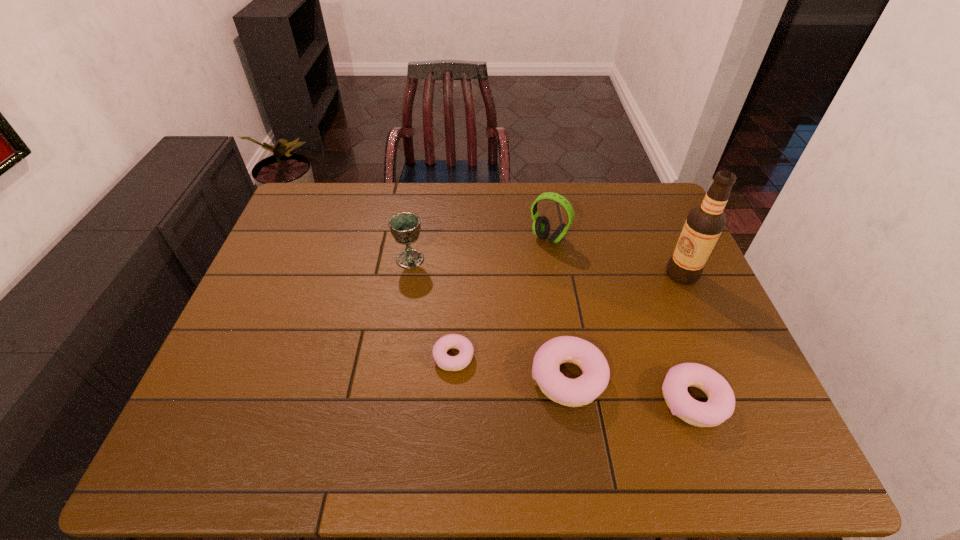
At what (x,y) coordinates should I click in order to perform the action: click on free space located 0.120m on the left of the second shortest doughnut. Please return your answer as a coordinate pair (x, y). The height and width of the screenshot is (540, 960). Looking at the image, I should click on (607, 401).

At what (x,y) coordinates should I click in order to perform the action: click on free spot located on the left of the headset. Please return your answer as a coordinate pair (x, y). Image resolution: width=960 pixels, height=540 pixels. Looking at the image, I should click on (497, 238).

The width and height of the screenshot is (960, 540). I want to click on vacant space situated 0.320m on the right of the chalice, so click(x=532, y=259).

Locate an element on the screen. The width and height of the screenshot is (960, 540). vacant region located on the label of the tallest object is located at coordinates (617, 274).

I want to click on vacant position located 0.350m on the label of the tallest object, so click(x=544, y=274).

This screenshot has width=960, height=540. In order to click on free space located on the label of the tallest object in this screenshot , I will do `click(641, 274)`.

Find the location of `doughnut positioned at the right edge`. doughnut positioned at the right edge is located at coordinates (720, 406).

This screenshot has height=540, width=960. Identify the location of alcohol that is at the right edge. (704, 224).

Where is `object positioned at the near right corner`? object positioned at the near right corner is located at coordinates (720, 406).

What are the coordinates of `free space at the far edge` in the screenshot? It's located at (511, 202).